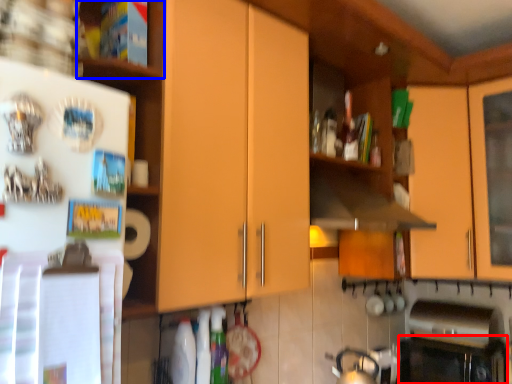
Question: Among these objects, which one is nearest to the camera, oven (highlighted by a red box) or shelf (highlighted by a blue box)?

Choices:
 (A) oven
 (B) shelf

Answer: (B)